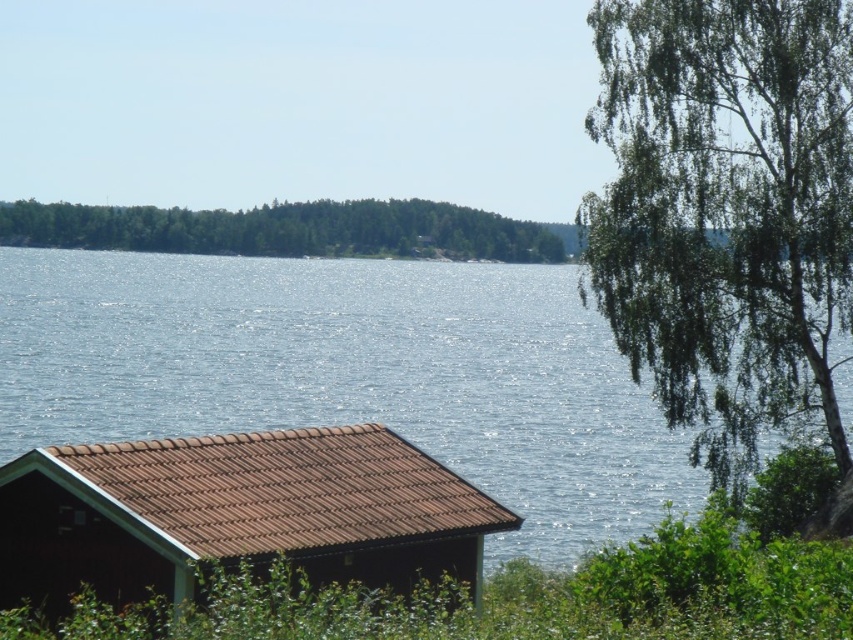
You are standing at the center of the image and want to find the brown tile cabin at lower left. According to the coordinates, in which direction should you look to locate it?

The brown tile cabin at lower left is located at coordinates 0.803 in the x and 0.278 in the y. Since you are at the center, you should look to the lower left direction to find it.

You are standing at the lakeside and want to take a photo of the brown tile cabin at lower left without the green leafy tree at upper right blocking the view. Is the tree too tall to block the cabin in your photo?

The green leafy tree at upper right is much taller than the brown tile cabin at lower left, so it might block the cabin in your photo depending on the angle and distance. Adjust your position to ensure the tree doesn